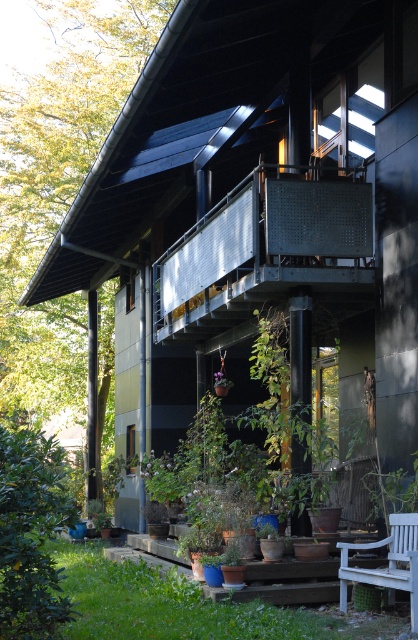
You are standing in front of the modern house and want to place a small bench exactly at the location of the green leafy plant at lower left. What are the coordinates where you should place the bench?

You should place the bench at coordinates point (30, 534) where the green leafy plant at lower left is located.

You are standing outside the modern house and want to place a new potted plant. The rusty metal balcony at upper center is to the right of the green leafy plant at lower left. Can you place the new potted plant between them?

The rusty metal balcony at upper center is to the right of the green leafy plant at lower left, so yes, you can place the new potted plant between them.